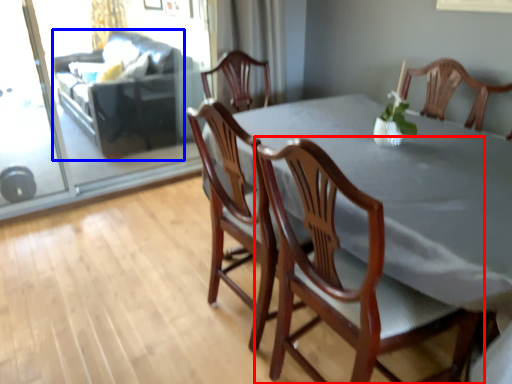
Question: Which object is closer to the camera taking this photo, chair (highlighted by a red box) or couch (highlighted by a blue box)?

Choices:
 (A) chair
 (B) couch

Answer: (A)